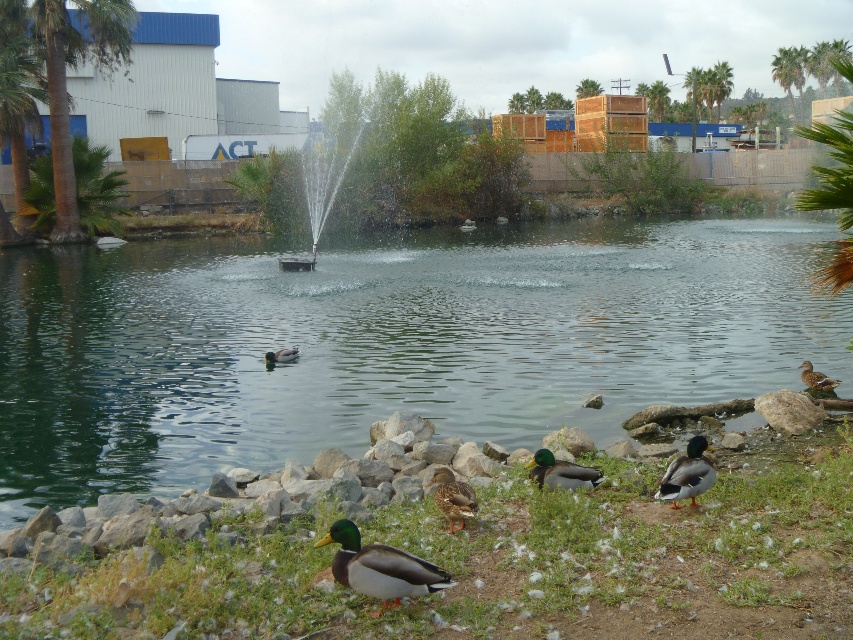
You are standing in the serene outdoor scene with the pond and fountain. You see two points marked in the image. Which point is closer to you, point (538, 237) or point (666, 493)?

Point (538, 237) is closer to you because it is further to the viewer than point (666, 493).